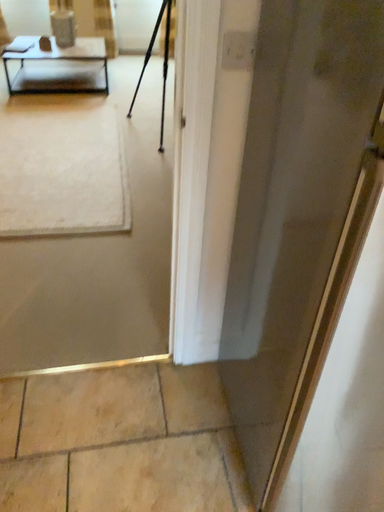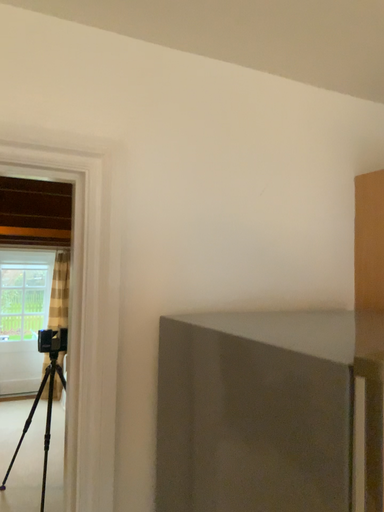
Question: How did the camera likely rotate when shooting the video?

Choices:
 (A) rotated right
 (B) rotated left

Answer: (A)